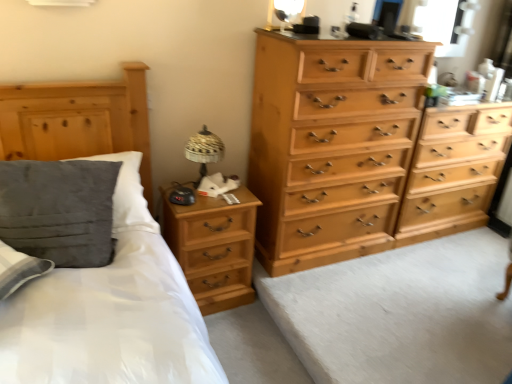
Where is `empty space that is ontop of light brown wood dresser at center (from a real-world perspective)`? empty space that is ontop of light brown wood dresser at center (from a real-world perspective) is located at coordinates (421, 293).